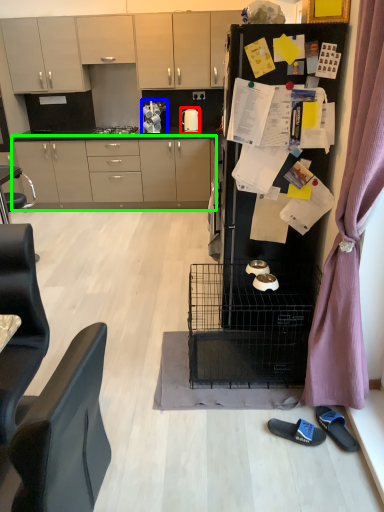
Question: Which object is positioned farthest from kitchen appliance (highlighted by a red box)? Select from appliance (highlighted by a blue box) and cabinetry (highlighted by a green box).

Choices:
 (A) appliance
 (B) cabinetry

Answer: (B)